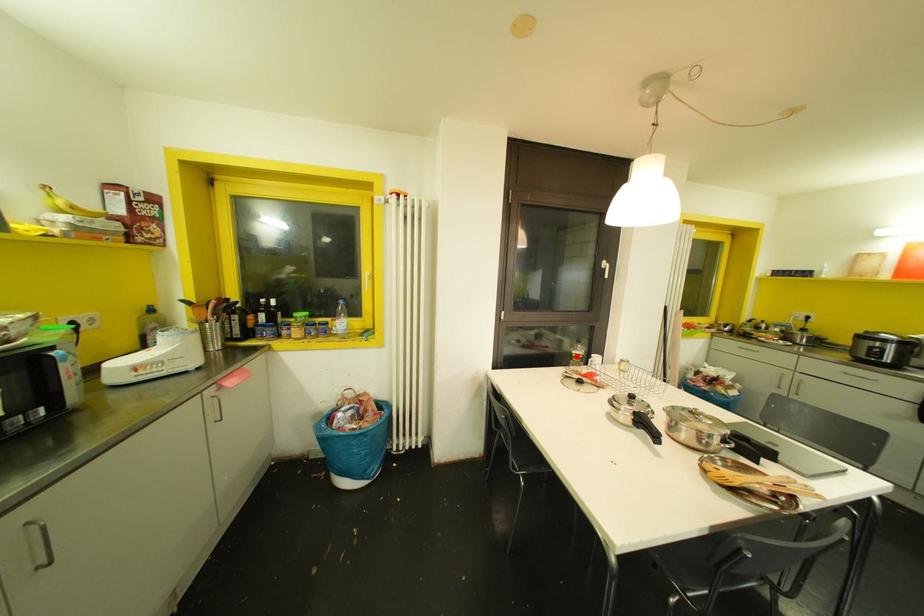
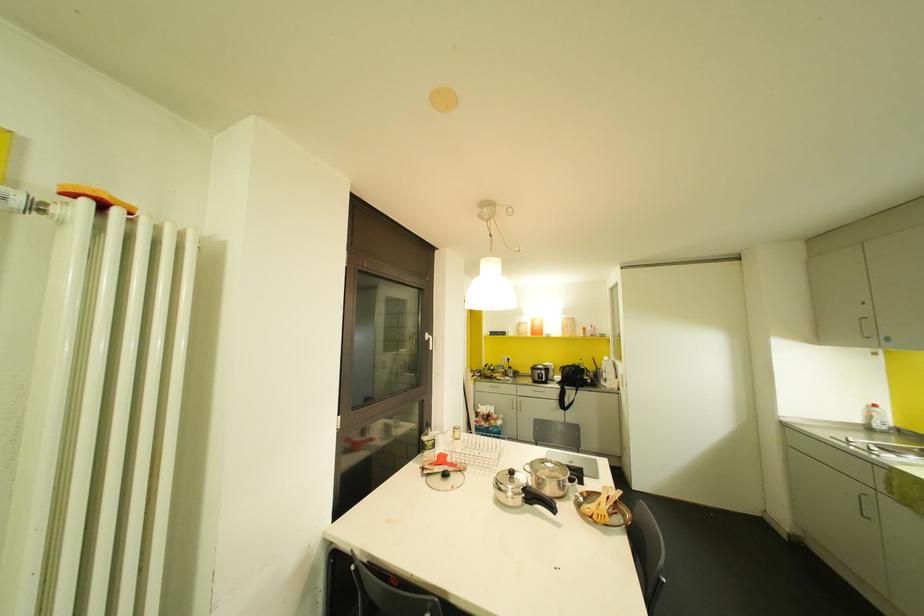
Find the pixel in the second image that matches the highlighted location in the first image.

(429, 444)